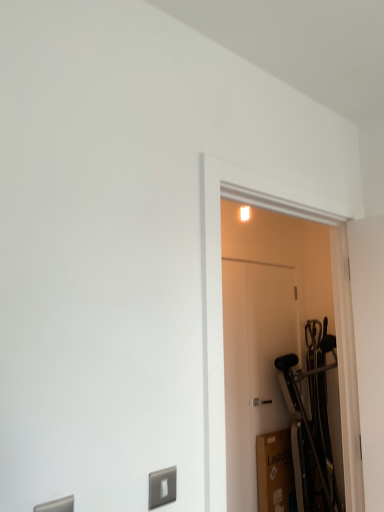
What is the approximate height of white matte door at center, acting as the first door starting from the front?

The height of white matte door at center, acting as the first door starting from the front, is 1.36 meters.

What is the approximate width of white matte door at center, acting as the second door starting from the back?

5.90 inches.

I want to click on white matte door at center, acting as the second door starting from the back, so click(x=268, y=314).

This screenshot has width=384, height=512. What do you see at coordinates (268, 314) in the screenshot? I see `white matte door at center, acting as the first door starting from the front` at bounding box center [268, 314].

What is the approximate height of white matte door at center, the 2th door viewed from the front?

It is 6.00 feet.

The image size is (384, 512). In order to click on white matte door at center, the 2th door viewed from the front in this screenshot , I will do `click(254, 366)`.

This screenshot has width=384, height=512. Describe the element at coordinates (254, 366) in the screenshot. I see `white matte door at center, the 2th door viewed from the front` at that location.

Locate an element on the screen. This screenshot has height=512, width=384. white matte door at center, acting as the second door starting from the back is located at coordinates pyautogui.click(x=268, y=314).

Consider the image. Between white matte door at center, the 2th door viewed from the front, and white matte door at center, acting as the first door starting from the front, which one appears on the right side from the viewer's perspective?

white matte door at center, the 2th door viewed from the front, is more to the right.

Who is more distant, white matte door at center, the 2th door viewed from the front, or white matte door at center, acting as the first door starting from the front?

Positioned behind is white matte door at center, the 2th door viewed from the front.

Considering the points (251, 498) and (225, 373), which point is behind, point (251, 498) or point (225, 373)?

The point (251, 498) is behind.

From the image's perspective, between white matte door at center, the 2th door viewed from the front, and white matte door at center, acting as the first door starting from the front, which one is located above?

white matte door at center, acting as the first door starting from the front.

From a real-world perspective, is white matte door at center, the 2th door viewed from the front, positioned above or below white matte door at center, acting as the first door starting from the front?

white matte door at center, the 2th door viewed from the front, is situated lower than white matte door at center, acting as the first door starting from the front, in the real world.

Does white matte door at center, the first door viewed from the back, have a lesser width compared to white matte door at center, acting as the second door starting from the back?

Yes.

Is white matte door at center, the 2th door viewed from the front, taller or shorter than white matte door at center, acting as the first door starting from the front?

Clearly, white matte door at center, the 2th door viewed from the front, is taller compared to white matte door at center, acting as the first door starting from the front.

Can you confirm if white matte door at center, the first door viewed from the back, is smaller than white matte door at center, acting as the second door starting from the back?

Yes.

Looking at this image, which is correct: white matte door at center, the 2th door viewed from the front, is inside white matte door at center, acting as the second door starting from the back, or outside of it?

white matte door at center, the 2th door viewed from the front, is outside white matte door at center, acting as the second door starting from the back.

Are white matte door at center, the 2th door viewed from the front, and white matte door at center, acting as the first door starting from the front, located far from each other?

No, white matte door at center, the 2th door viewed from the front, is in close proximity to white matte door at center, acting as the first door starting from the front.

Is white matte door at center, the 2th door viewed from the front, aimed at white matte door at center, acting as the first door starting from the front?

No, white matte door at center, the 2th door viewed from the front, is not facing towards white matte door at center, acting as the first door starting from the front.

Can you tell me how much white matte door at center, the 2th door viewed from the front, and white matte door at center, acting as the second door starting from the back, differ in facing direction?

The angular difference between white matte door at center, the 2th door viewed from the front, and white matte door at center, acting as the second door starting from the back, is 0.133 degrees.

This screenshot has height=512, width=384. Identify the location of door lying behind the white matte door at center, acting as the second door starting from the back. (x=254, y=366).

Is white matte door at center, acting as the second door starting from the back, to the left or to the right of white matte door at center, the first door viewed from the back, in the image?

Clearly, white matte door at center, acting as the second door starting from the back, is on the left of white matte door at center, the first door viewed from the back, in the image.

Considering the relative positions of white matte door at center, acting as the second door starting from the back, and white matte door at center, the 2th door viewed from the front, in the image provided, is white matte door at center, acting as the second door starting from the back, behind white matte door at center, the 2th door viewed from the front,?

No, white matte door at center, acting as the second door starting from the back, is closer to the camera.

Does point (274, 342) come farther from viewer compared to point (225, 378)?

Yes.

In the scene shown: From the image's perspective, is white matte door at center, acting as the first door starting from the front, located above or below white matte door at center, the first door viewed from the back?

white matte door at center, acting as the first door starting from the front, is above white matte door at center, the first door viewed from the back.

From a real-world perspective, does white matte door at center, acting as the second door starting from the back, stand above white matte door at center, the first door viewed from the back?

Indeed, from a real-world perspective, white matte door at center, acting as the second door starting from the back, stands above white matte door at center, the first door viewed from the back.

In terms of width, does white matte door at center, acting as the first door starting from the front, look wider or thinner when compared to white matte door at center, the 2th door viewed from the front?

Considering their sizes, white matte door at center, acting as the first door starting from the front, looks broader than white matte door at center, the 2th door viewed from the front.

Consider the image. Is white matte door at center, acting as the second door starting from the back, taller or shorter than white matte door at center, the 2th door viewed from the front?

Considering their sizes, white matte door at center, acting as the second door starting from the back, has less height than white matte door at center, the 2th door viewed from the front.

Can you confirm if white matte door at center, acting as the first door starting from the front, is smaller than white matte door at center, the 2th door viewed from the front?

Incorrect, white matte door at center, acting as the first door starting from the front, is not smaller in size than white matte door at center, the 2th door viewed from the front.

Looking at this image, is white matte door at center, the first door viewed from the back, surrounded by white matte door at center, acting as the second door starting from the back?

No, white matte door at center, the first door viewed from the back, is not inside white matte door at center, acting as the second door starting from the back.

Is white matte door at center, acting as the second door starting from the back, far away from white matte door at center, the first door viewed from the back?

No, white matte door at center, acting as the second door starting from the back, is in close proximity to white matte door at center, the first door viewed from the back.

Is white matte door at center, acting as the first door starting from the front, facing away from white matte door at center, the 2th door viewed from the front?

No, white matte door at center, acting as the first door starting from the front, is not facing the opposite direction of white matte door at center, the 2th door viewed from the front.

What's the angular difference between white matte door at center, acting as the second door starting from the back, and white matte door at center, the first door viewed from the back,'s facing directions?

0.133 degrees.

Locate an element on the screen. The image size is (384, 512). door above the white matte door at center, the 2th door viewed from the front (from the image's perspective) is located at coordinates (268, 314).

Identify the location of door directly beneath the white matte door at center, acting as the second door starting from the back (from a real-world perspective). This screenshot has height=512, width=384. (254, 366).

You are a GUI agent. You are given a task and a screenshot of the screen. Output one action in this format:
    pyautogui.click(x=<x>, y=<y>)
    Task: Click on the door that is behind the white matte door at center, acting as the second door starting from the back
    
    Given the screenshot: What is the action you would take?
    pyautogui.click(x=254, y=366)